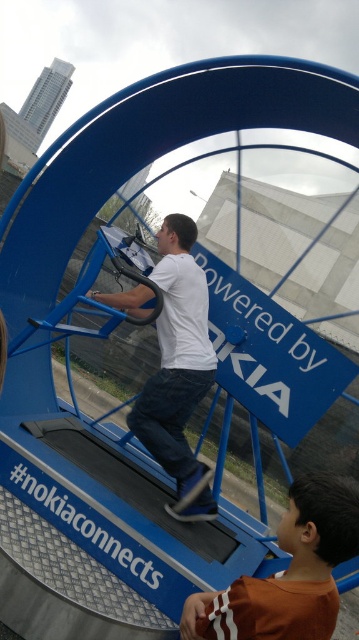
You are standing at the entrance of the exhibit and see the point at coordinates (287, 572). What object is located at that point?

The point at coordinates (287, 572) corresponds to the brown cotton shirt at lower right.

You are an event organizer at the Nokia exhibit and need to place a new sign. The sign must be visible to both the person wearing the brown cotton shirt at lower right and the person wearing the white matte shirt at center. Where should you position the sign so that both can see it without moving their heads?

The sign should be placed between the brown cotton shirt at lower right and the white matte shirt at center, ensuring it is equidistant from both so that both can see it without moving their heads.

You are at an interactive exhibit and see two shirts displayed near the stationary bike. The brown cotton shirt at lower right and the white matte shirt at center. Which shirt is positioned lower in the scene?

The brown cotton shirt at lower right is positioned lower than the white matte shirt at center in the scene.